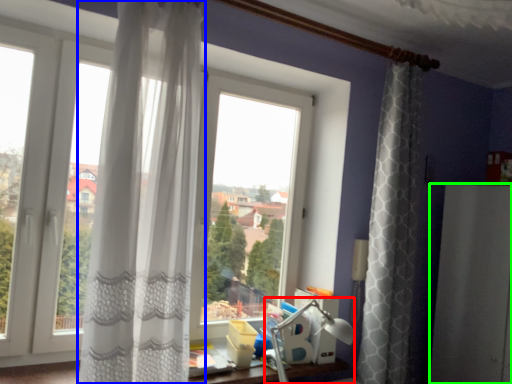
Question: Considering the real-world distances, which object is farthest from table lamp (highlighted by a red box)? curtain (highlighted by a blue box) or screen door (highlighted by a green box)?

Choices:
 (A) curtain
 (B) screen door

Answer: (A)